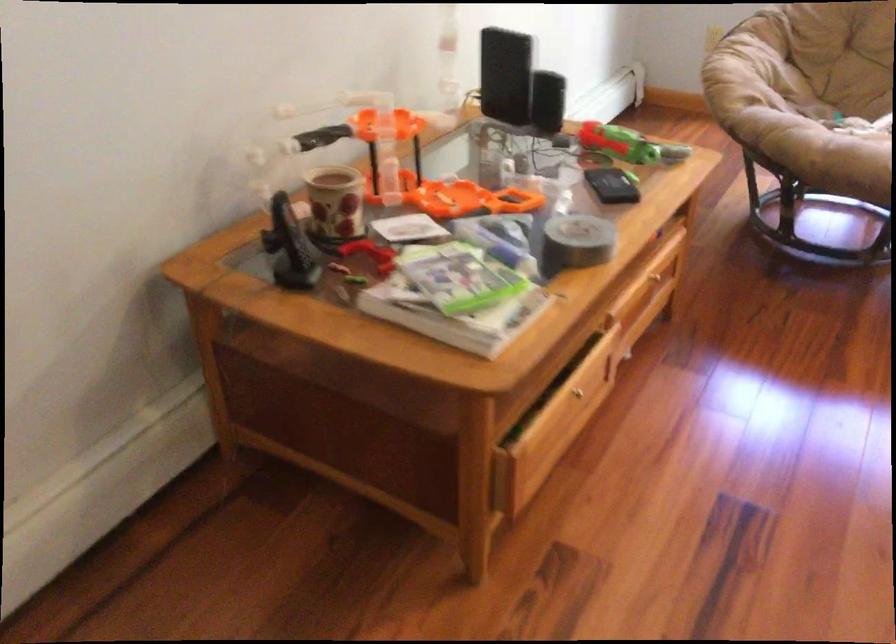
Identify the location of green toy gun. (627, 145).